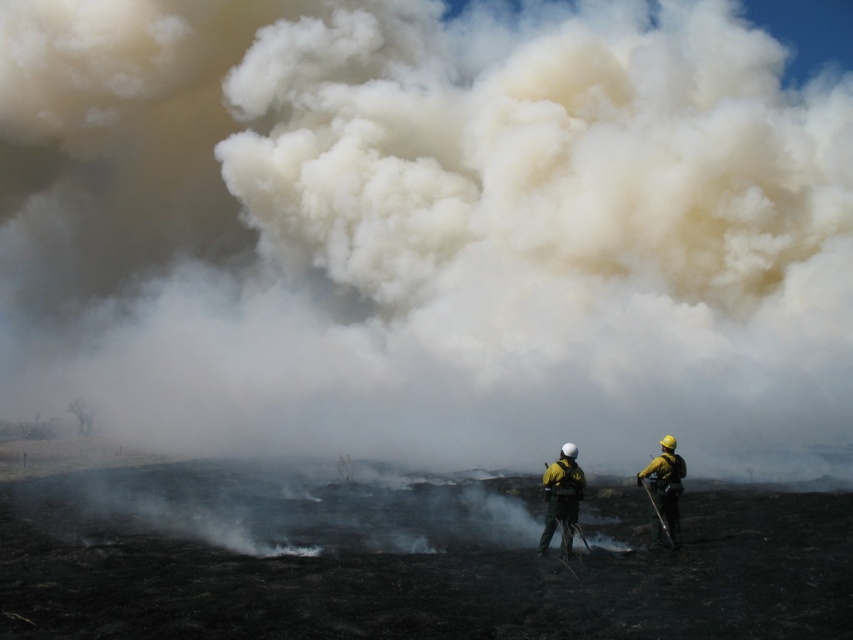
Is white smoke at center above yellow hard hat at right?

Yes, white smoke at center is above yellow hard hat at right.

Between point (225, 164) and point (656, 506), which one is positioned in front?

Point (656, 506) is more forward.

Find the location of a particular element. This screenshot has height=640, width=853. white smoke at center is located at coordinates (424, 230).

Locate an element on the screen. The width and height of the screenshot is (853, 640). white smoke at center is located at coordinates (424, 230).

Does white smoke at center have a lesser width compared to yellow hard hat at center?

No, white smoke at center is not thinner than yellow hard hat at center.

Does white smoke at center have a larger size compared to yellow hard hat at center?

Correct, white smoke at center is larger in size than yellow hard hat at center.

The height and width of the screenshot is (640, 853). What do you see at coordinates (424, 230) in the screenshot?
I see `white smoke at center` at bounding box center [424, 230].

This screenshot has height=640, width=853. What are the coordinates of `white smoke at center` in the screenshot? It's located at (424, 230).

Looking at this image, who is more distant from viewer, (x=555, y=477) or (x=659, y=509)?

The point (x=659, y=509) is behind.

Between yellow hard hat at center and yellow hard hat at right, which one is positioned lower?

Positioned lower is yellow hard hat at center.

Identify the location of yellow hard hat at center. (561, 499).

The width and height of the screenshot is (853, 640). What are the coordinates of `yellow hard hat at center` in the screenshot? It's located at (561, 499).